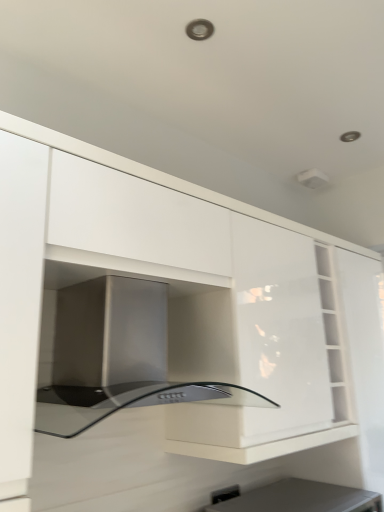
Question: Does stainless steel oven at center contain black plastic electric outlet at lower center?

Choices:
 (A) yes
 (B) no

Answer: (B)

Question: Considering the relative sizes of stainless steel oven at center and black plastic electric outlet at lower center in the image provided, is stainless steel oven at center wider than black plastic electric outlet at lower center?

Choices:
 (A) yes
 (B) no

Answer: (A)

Question: Is stainless steel oven at center positioned before black plastic electric outlet at lower center?

Choices:
 (A) yes
 (B) no

Answer: (A)

Question: Could you tell me if stainless steel oven at center is turned towards black plastic electric outlet at lower center?

Choices:
 (A) yes
 (B) no

Answer: (B)

Question: Is stainless steel oven at center with black plastic electric outlet at lower center?

Choices:
 (A) yes
 (B) no

Answer: (B)

Question: Would you say black plastic electric outlet at lower center is inside or outside matte black appliance at lower center?

Choices:
 (A) inside
 (B) outside

Answer: (B)

Question: Based on their positions, is black plastic electric outlet at lower center located to the left or right of matte black appliance at lower center?

Choices:
 (A) right
 (B) left

Answer: (B)

Question: Is black plastic electric outlet at lower center taller or shorter than matte black appliance at lower center?

Choices:
 (A) tall
 (B) short

Answer: (B)

Question: From a real-world perspective, is black plastic electric outlet at lower center above or below matte black appliance at lower center?

Choices:
 (A) below
 (B) above

Answer: (B)

Question: In the image, is stainless steel oven at center positioned in front of or behind matte black appliance at lower center?

Choices:
 (A) front
 (B) behind

Answer: (A)

Question: Considering the positions of point (99, 379) and point (246, 497), is point (99, 379) closer or farther from the camera than point (246, 497)?

Choices:
 (A) closer
 (B) farther

Answer: (A)

Question: In terms of width, does stainless steel oven at center look wider or thinner when compared to matte black appliance at lower center?

Choices:
 (A) wide
 (B) thin

Answer: (B)

Question: From a real-world perspective, is stainless steel oven at center above or below matte black appliance at lower center?

Choices:
 (A) above
 (B) below

Answer: (A)

Question: Is matte black appliance at lower center wider or thinner than black plastic electric outlet at lower center?

Choices:
 (A) thin
 (B) wide

Answer: (B)

Question: Considering the positions of matte black appliance at lower center and black plastic electric outlet at lower center in the image, is matte black appliance at lower center taller or shorter than black plastic electric outlet at lower center?

Choices:
 (A) short
 (B) tall

Answer: (B)